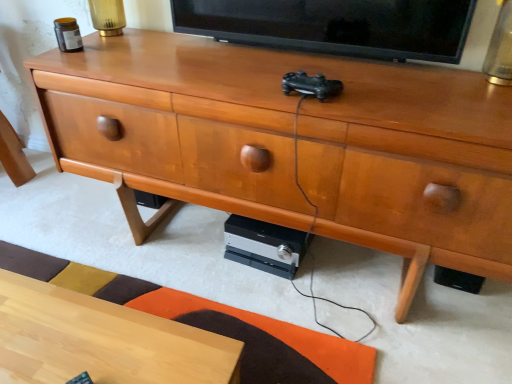
What do you see at coordinates (335, 26) in the screenshot? I see `black glossy tv at upper center` at bounding box center [335, 26].

Locate an element on the screen. black glossy tv at upper center is located at coordinates (335, 26).

The width and height of the screenshot is (512, 384). What do you see at coordinates (101, 340) in the screenshot?
I see `light wood desk at lower left` at bounding box center [101, 340].

Locate an element on the screen. The image size is (512, 384). wooden chest of drawers at center is located at coordinates (293, 143).

Is point (322, 201) closer to viewer compared to point (125, 351)?

No, it is not.

Is light wood desk at lower left surrounded by wooden chest of drawers at center?

That's incorrect, light wood desk at lower left is not inside wooden chest of drawers at center.

Looking at this image, is wooden chest of drawers at center oriented towards light wood desk at lower left?

Yes, wooden chest of drawers at center is turned towards light wood desk at lower left.

You are a GUI agent. You are given a task and a screenshot of the screen. Output one action in this format:
    pyautogui.click(x=<x>, y=<y>)
    Task: Click on the chest of drawers above the light wood desk at lower left (from a real-world perspective)
    The width and height of the screenshot is (512, 384).
    Given the screenshot: What is the action you would take?
    pyautogui.click(x=293, y=143)

You are a GUI agent. You are given a task and a screenshot of the screen. Output one action in this format:
    pyautogui.click(x=<x>, y=<y>)
    Task: Click on the desk on the left of black glossy tv at upper center
    The width and height of the screenshot is (512, 384).
    Given the screenshot: What is the action you would take?
    pyautogui.click(x=101, y=340)

Which point is more forward, [123,359] or [291,26]?

The point [123,359] is in front.

Who is shorter, light wood desk at lower left or black glossy tv at upper center?

With less height is black glossy tv at upper center.

Is light wood desk at lower left looking in the opposite direction of black glossy tv at upper center?

light wood desk at lower left is not turned away from black glossy tv at upper center.

From a real-world perspective, is light wood desk at lower left physically located above or below wooden chest of drawers at center?

Clearly, from a real-world perspective, light wood desk at lower left is below wooden chest of drawers at center.

Can you confirm if light wood desk at lower left is shorter than wooden chest of drawers at center?

Yes.

Is the surface of light wood desk at lower left in direct contact with wooden chest of drawers at center?

No, light wood desk at lower left is not in contact with wooden chest of drawers at center.

Find the location of `stereo that appears below the wooden chest of drawers at center (from the image's perspective)`. stereo that appears below the wooden chest of drawers at center (from the image's perspective) is located at coordinates (265, 245).

Considering the positions of objects wooden chest of drawers at center and silver/black plastic stereo at lower center in the image provided, who is more to the right, wooden chest of drawers at center or silver/black plastic stereo at lower center?

From the viewer's perspective, silver/black plastic stereo at lower center appears more on the right side.

From a real-world perspective, is wooden chest of drawers at center located beneath silver/black plastic stereo at lower center?

No, from a real-world perspective, wooden chest of drawers at center is not below silver/black plastic stereo at lower center.

Does point (134, 128) lie in front of point (241, 218)?

Yes.

Visually, is silver/black plastic stereo at lower center positioned to the left or to the right of black glossy tv at upper center?

In the image, silver/black plastic stereo at lower center appears on the left side of black glossy tv at upper center.

Which object is closer to the camera taking this photo, silver/black plastic stereo at lower center or black glossy tv at upper center?

black glossy tv at upper center.

Could you tell me if silver/black plastic stereo at lower center is facing black glossy tv at upper center?

No, silver/black plastic stereo at lower center does not turn towards black glossy tv at upper center.

Looking at this image, can you confirm if black glossy tv at upper center is shorter than silver/black plastic stereo at lower center?

No, black glossy tv at upper center is not shorter than silver/black plastic stereo at lower center.

Is black glossy tv at upper center in front of or behind silver/black plastic stereo at lower center in the image?

Clearly, black glossy tv at upper center is in front of silver/black plastic stereo at lower center.

Is silver/black plastic stereo at lower center completely or partially outside of light wood desk at lower left?

silver/black plastic stereo at lower center lies outside light wood desk at lower left's area.

From a real-world perspective, is silver/black plastic stereo at lower center located higher than light wood desk at lower left?

No.

What's the angular difference between silver/black plastic stereo at lower center and light wood desk at lower left's facing directions?

The facing directions of silver/black plastic stereo at lower center and light wood desk at lower left are 6.69 degrees apart.

Which is closer to the camera, (293, 269) or (169, 362)?

Point (293, 269) is farther from the camera than point (169, 362).

You are a GUI agent. You are given a task and a screenshot of the screen. Output one action in this format:
    pyautogui.click(x=<x>, y=<y>)
    Task: Click on the chest of drawers above the light wood desk at lower left (from the image's perspective)
    This screenshot has width=512, height=384.
    Given the screenshot: What is the action you would take?
    pyautogui.click(x=293, y=143)

This screenshot has width=512, height=384. I want to click on television behind the light wood desk at lower left, so click(x=335, y=26).

Considering their positions, is silver/black plastic stereo at lower center positioned closer to wooden chest of drawers at center than black glossy tv at upper center?

black glossy tv at upper center is positioned closer to the anchor wooden chest of drawers at center.

Which object lies nearer to the anchor point black glossy tv at upper center, wooden chest of drawers at center or silver/black plastic stereo at lower center?

wooden chest of drawers at center lies closer to black glossy tv at upper center than the other object.

Looking at the image, which one is located further to black glossy tv at upper center, wooden chest of drawers at center or light wood desk at lower left?

Among the two, light wood desk at lower left is located further to black glossy tv at upper center.

Which object lies nearer to the anchor point black glossy tv at upper center, light wood desk at lower left or silver/black plastic stereo at lower center?

Based on the image, silver/black plastic stereo at lower center appears to be nearer to black glossy tv at upper center.

From the image, which object appears to be nearer to wooden chest of drawers at center, black glossy tv at upper center or light wood desk at lower left?

Among the two, black glossy tv at upper center is located nearer to wooden chest of drawers at center.

Considering their positions, is silver/black plastic stereo at lower center positioned further to black glossy tv at upper center than wooden chest of drawers at center?

silver/black plastic stereo at lower center is further to black glossy tv at upper center.

Consider the image. Based on their spatial positions, is wooden chest of drawers at center or light wood desk at lower left further from silver/black plastic stereo at lower center?

light wood desk at lower left is further to silver/black plastic stereo at lower center.

Based on the photo, which object lies nearer to the anchor point light wood desk at lower left, silver/black plastic stereo at lower center or wooden chest of drawers at center?

wooden chest of drawers at center.

Identify the location of chest of drawers between black glossy tv at upper center and light wood desk at lower left from top to bottom. The height and width of the screenshot is (384, 512). (293, 143).

Locate an element on the screen. The width and height of the screenshot is (512, 384). chest of drawers between black glossy tv at upper center and silver/black plastic stereo at lower center from top to bottom is located at coordinates (293, 143).

Identify the location of chest of drawers between light wood desk at lower left and silver/black plastic stereo at lower center in the front-back direction. (293, 143).

Find the location of a particular element. stereo that lies between black glossy tv at upper center and light wood desk at lower left from top to bottom is located at coordinates (265, 245).